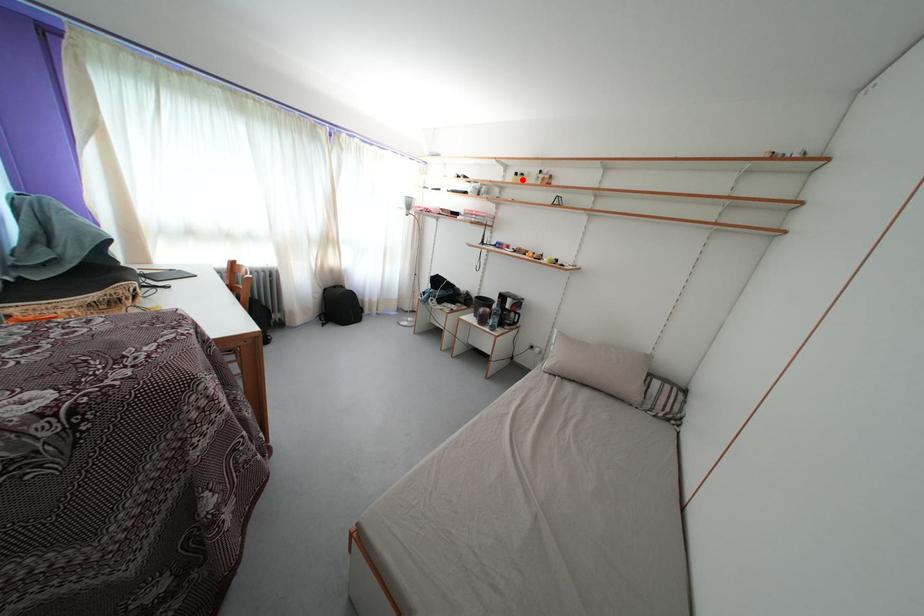
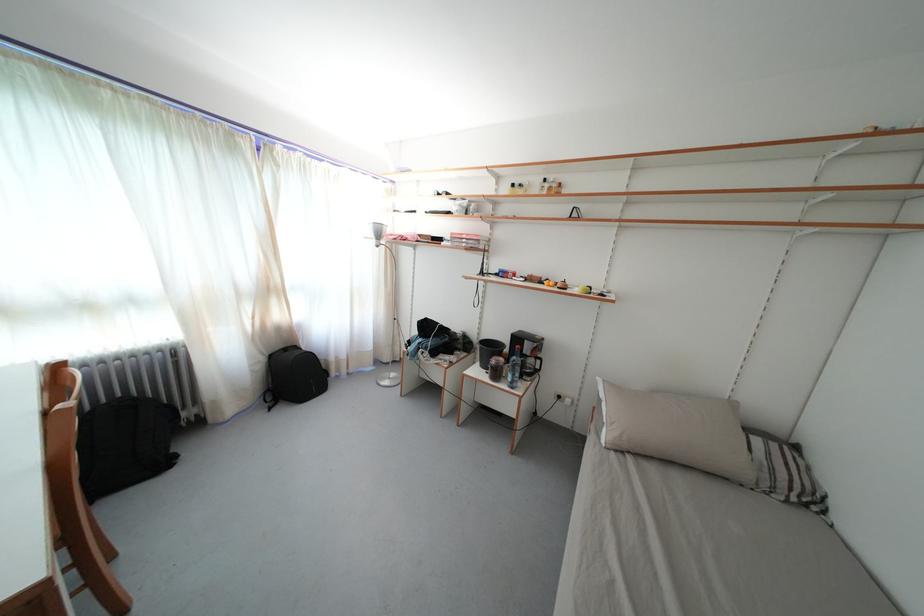
Find the pixel in the second image that matches the highlighted location in the first image.

(518, 191)